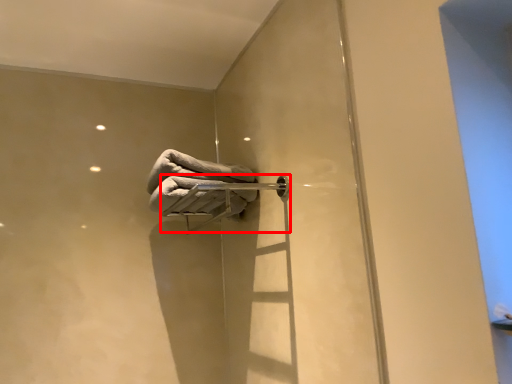
Question: From the image's perspective, where is towel bar (annotated by the red box) located in relation to towel in the image?

Choices:
 (A) above
 (B) below

Answer: (B)